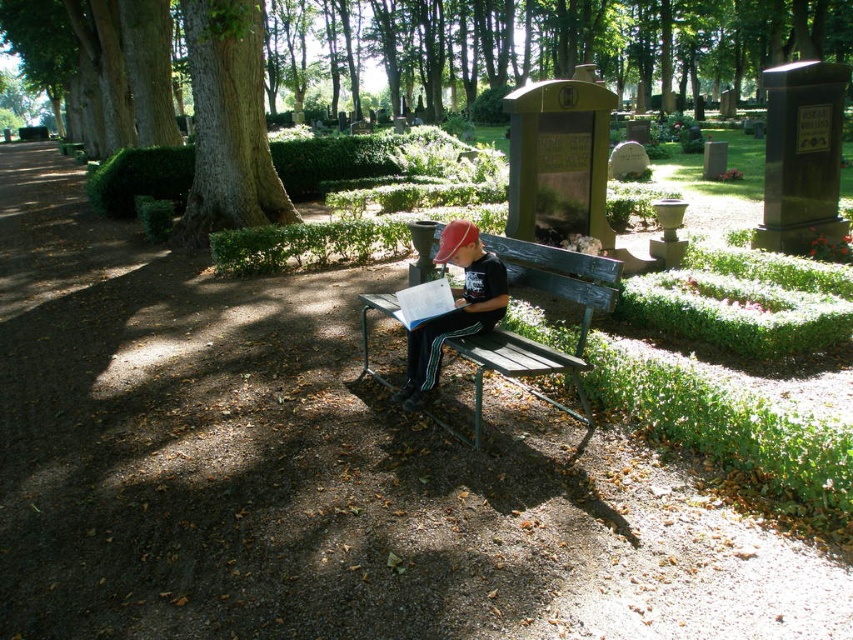
Question: Which object is the farthest from the wooden bench at center?

Choices:
 (A) green textured tree at upper left
 (B) green leafy tree at center
 (C) matte black cap at center

Answer: (B)

Question: Considering the real-world distances, which object is closest to the green leafy tree at center?

Choices:
 (A) matte black cap at center
 (B) wooden bench at center

Answer: (A)

Question: Does green textured tree at upper left have a lesser width compared to matte black cap at center?

Choices:
 (A) no
 (B) yes

Answer: (A)

Question: Is green textured tree at upper left further to the viewer compared to matte black cap at center?

Choices:
 (A) yes
 (B) no

Answer: (A)

Question: Among these points, which one is nearest to the camera?

Choices:
 (A) (503, 250)
 (B) (250, 182)

Answer: (A)

Question: Does wooden bench at center lie in front of matte black cap at center?

Choices:
 (A) no
 (B) yes

Answer: (B)